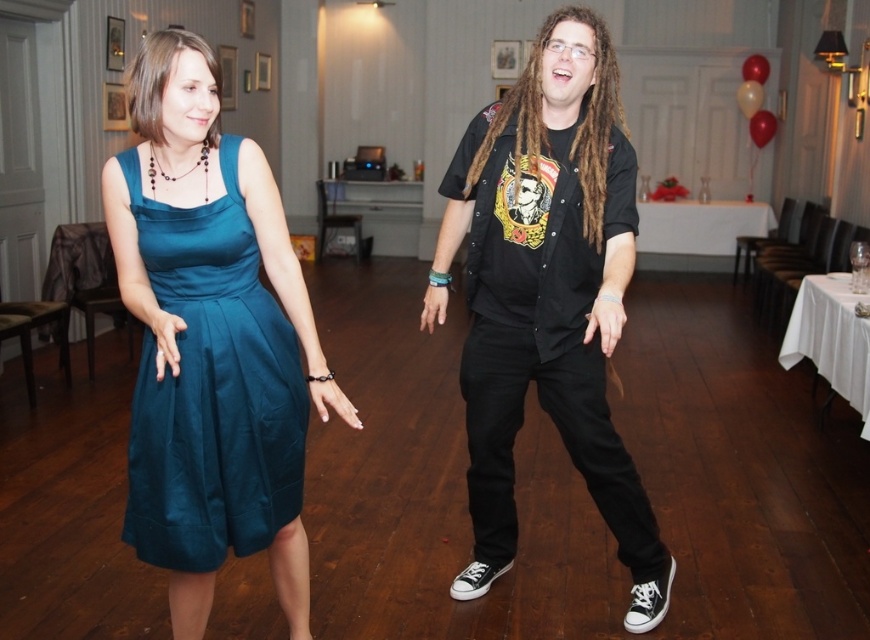
Question: Which point is closer to the camera?

Choices:
 (A) (248, 509)
 (B) (486, 481)
 (C) (589, 209)

Answer: (A)

Question: Which point is closer to the camera taking this photo?

Choices:
 (A) (226, 387)
 (B) (564, 432)

Answer: (A)

Question: Can you confirm if black matte shirt at center is thinner than teal satin dress at left?

Choices:
 (A) no
 (B) yes

Answer: (A)

Question: Which is nearer to the teal satin dress at center?

Choices:
 (A) teal satin dress at left
 (B) black matte shirt at center

Answer: (B)

Question: From the image, what is the correct spatial relationship of teal satin dress at center in relation to black matte shirt at center?

Choices:
 (A) above
 (B) below

Answer: (B)

Question: Is teal satin dress at center further to camera compared to black matte shirt at center?

Choices:
 (A) no
 (B) yes

Answer: (B)